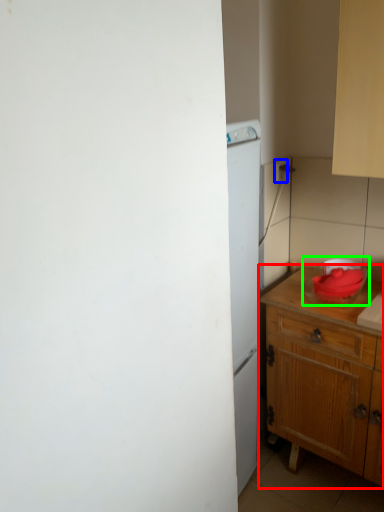
Question: Which object is positioned farthest from table (highlighted by a red box)? Select from electric outlet (highlighted by a blue box) and appliance (highlighted by a green box).

Choices:
 (A) electric outlet
 (B) appliance

Answer: (A)